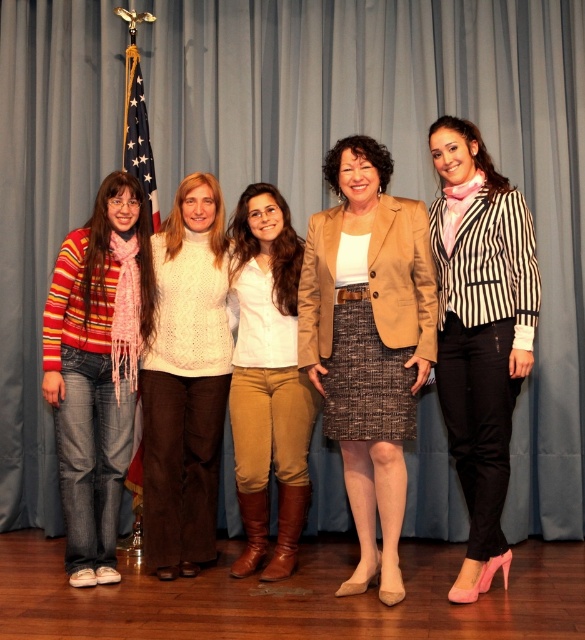
Question: Can you confirm if striped fabric blazer at right is bigger than white knitted sweater at center?

Choices:
 (A) no
 (B) yes

Answer: (B)

Question: Is striped fabric blazer at right closer to camera compared to american flag at left?

Choices:
 (A) no
 (B) yes

Answer: (B)

Question: Can you confirm if striped sweater at left is positioned below american flag at left?

Choices:
 (A) yes
 (B) no

Answer: (A)

Question: Which point is closer to the camera taking this photo?

Choices:
 (A) (128, 625)
 (B) (488, 424)
 (C) (146, 177)
 (D) (302, 276)

Answer: (A)

Question: Which of the following is the closest to the observer?

Choices:
 (A) (142, 116)
 (B) (270, 218)
 (C) (357, 456)
 (D) (12, 596)

Answer: (D)

Question: Which object is the closest to the wooden floor at lower center?

Choices:
 (A) light brown leather boots at center
 (B) striped fabric blazer at right

Answer: (A)